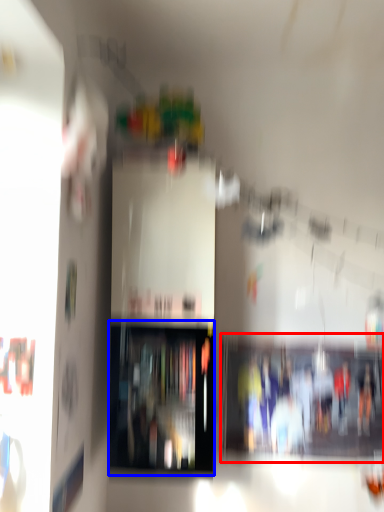
Question: Which object appears farthest to the camera in this image, shelf (highlighted by a red box) or shelf (highlighted by a blue box)?

Choices:
 (A) shelf
 (B) shelf

Answer: (A)